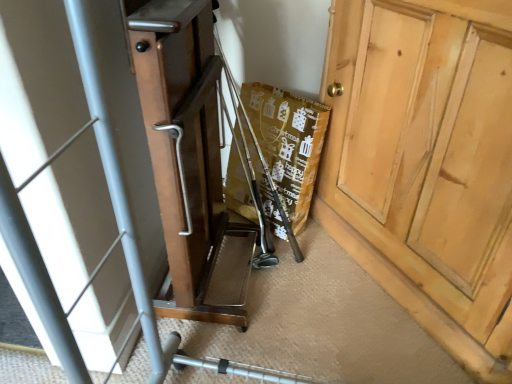
Question: Should I look upward or downward to see metallic silver baby carriage at lower center?

Choices:
 (A) up
 (B) down

Answer: (B)

Question: Does light brown wooden cabinet at right appear on the left side of metallic silver baby carriage at lower center?

Choices:
 (A) yes
 (B) no

Answer: (B)

Question: Are light brown wooden cabinet at right and metallic silver baby carriage at lower center far apart?

Choices:
 (A) no
 (B) yes

Answer: (A)

Question: From a real-world perspective, is light brown wooden cabinet at right located beneath metallic silver baby carriage at lower center?

Choices:
 (A) yes
 (B) no

Answer: (A)

Question: Is light brown wooden cabinet at right further to camera compared to metallic silver baby carriage at lower center?

Choices:
 (A) no
 (B) yes

Answer: (B)

Question: Does light brown wooden cabinet at right appear on the right side of metallic silver baby carriage at lower center?

Choices:
 (A) no
 (B) yes

Answer: (B)

Question: Would you say light brown wooden cabinet at right is outside metallic silver baby carriage at lower center?

Choices:
 (A) no
 (B) yes

Answer: (B)

Question: Are metallic silver baby carriage at lower center and light brown wooden cabinet at right far apart?

Choices:
 (A) yes
 (B) no

Answer: (B)

Question: From the image's perspective, is metallic silver baby carriage at lower center beneath light brown wooden cabinet at right?

Choices:
 (A) yes
 (B) no

Answer: (A)

Question: Is metallic silver baby carriage at lower center bigger than light brown wooden cabinet at right?

Choices:
 (A) no
 (B) yes

Answer: (B)

Question: Does metallic silver baby carriage at lower center have a smaller size compared to light brown wooden cabinet at right?

Choices:
 (A) no
 (B) yes

Answer: (A)

Question: Is metallic silver baby carriage at lower center wider than light brown wooden cabinet at right?

Choices:
 (A) yes
 (B) no

Answer: (A)

Question: Is metallic silver baby carriage at lower center outside light brown wooden cabinet at right?

Choices:
 (A) no
 (B) yes

Answer: (B)

Question: Choose the correct answer: Is metallic silver baby carriage at lower center inside light brown wooden cabinet at right or outside it?

Choices:
 (A) inside
 (B) outside

Answer: (B)